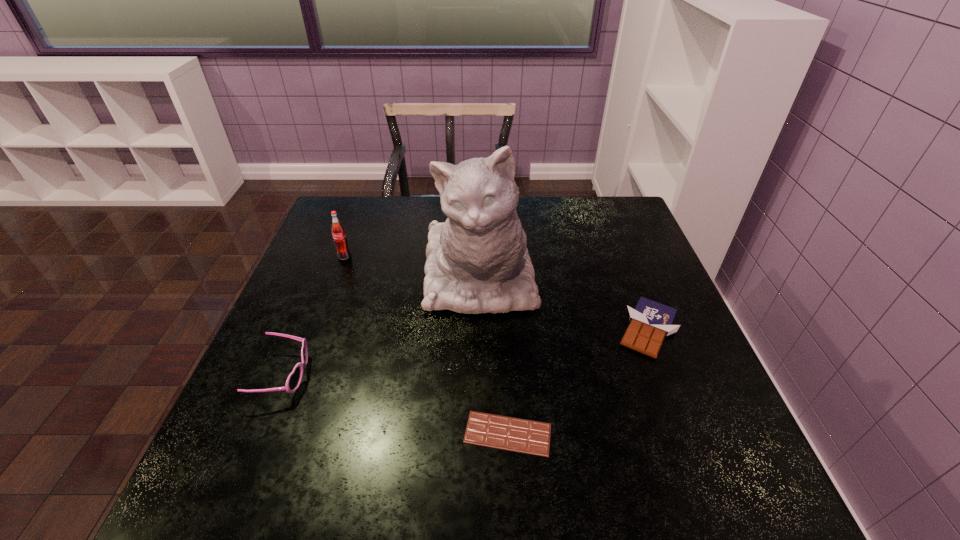
Locate an element on the screen. This screenshot has height=540, width=960. object that is the third nearest to the sunglasses is located at coordinates (525, 436).

The height and width of the screenshot is (540, 960). What are the coordinates of `the second closest object to the left chocolate bar` in the screenshot? It's located at (650, 321).

What are the coordinates of `vacant space that satisfies the following two spatial constraints: 1. on the front-facing side of the third tallest object; 2. on the back side of the left chocolate bar` in the screenshot? It's located at (260, 434).

Find the location of a particular element. vacant area that satisfies the following two spatial constraints: 1. on the label of the soda bottle; 2. on the front-facing side of the third shortest object is located at coordinates (300, 375).

Locate an element on the screen. The height and width of the screenshot is (540, 960). vacant area that satisfies the following two spatial constraints: 1. on the front-facing side of the tallest object; 2. on the left side of the right chocolate bar is located at coordinates (479, 329).

The height and width of the screenshot is (540, 960). What are the coordinates of `vacant area that satisfies the following two spatial constraints: 1. on the front-facing side of the tallest object; 2. on the right side of the left chocolate bar` in the screenshot? It's located at click(479, 434).

Where is `free space that satisfies the following two spatial constraints: 1. on the front side of the rightmost object; 2. on the front-facing side of the sunglasses`? The width and height of the screenshot is (960, 540). free space that satisfies the following two spatial constraints: 1. on the front side of the rightmost object; 2. on the front-facing side of the sunglasses is located at coordinates (665, 375).

Locate an element on the screen. This screenshot has height=540, width=960. vacant region that satisfies the following two spatial constraints: 1. on the label of the fourth tallest object; 2. on the left side of the soda bottle is located at coordinates (317, 329).

Image resolution: width=960 pixels, height=540 pixels. Find the location of `free space that satisfies the following two spatial constraints: 1. on the label of the second tallest object; 2. on the front-facing side of the third tallest object`. free space that satisfies the following two spatial constraints: 1. on the label of the second tallest object; 2. on the front-facing side of the third tallest object is located at coordinates (300, 375).

Where is `free location that satisfies the following two spatial constraints: 1. on the front-facing side of the right chocolate bar; 2. on the right side of the cat`? The height and width of the screenshot is (540, 960). free location that satisfies the following two spatial constraints: 1. on the front-facing side of the right chocolate bar; 2. on the right side of the cat is located at coordinates (479, 329).